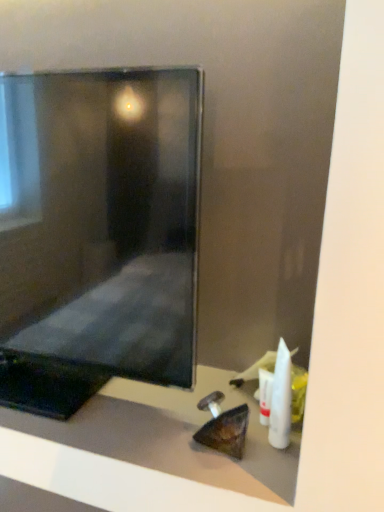
The image size is (384, 512). I want to click on vacant space behind white plastic tube at lower right, placed as the 1th toiletry when sorted from back to front, so click(231, 389).